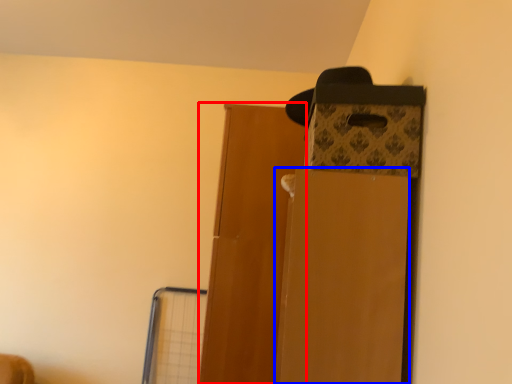
Question: Among these objects, which one is farthest to the camera, door (highlighted by a red box) or cardboard box (highlighted by a blue box)?

Choices:
 (A) door
 (B) cardboard box

Answer: (A)